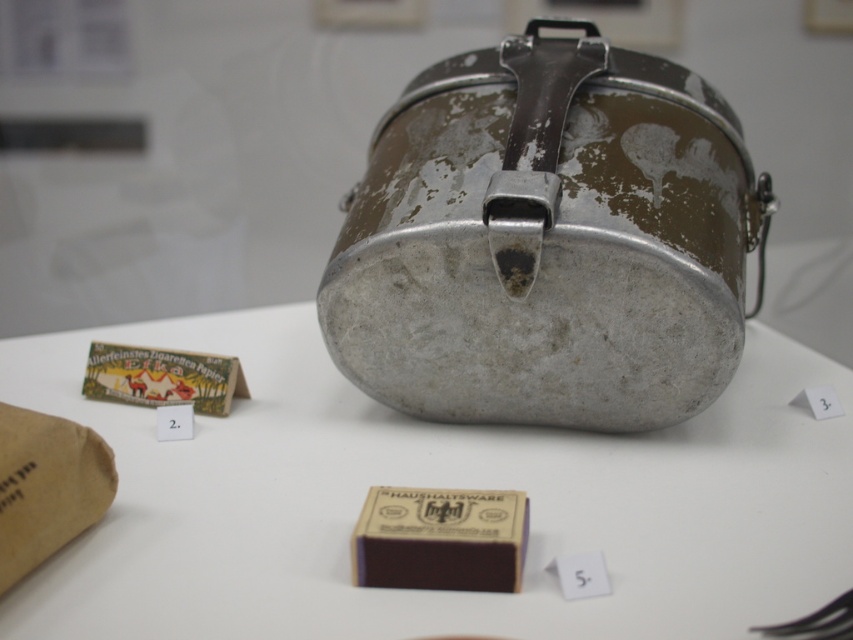
You are a delivery person who needs to place a 12 inch long package between the metallic silver container at center and the brown paper bag at lower left. Can you fit it there?

The distance between the metallic silver container at center and the brown paper bag at lower left is 12.30 inches. Since the package is 12 inches long, it can fit in the space between them as there is enough room.

You are an appraiser examining the items in the scene. You need to assess the distance between the metallic silver container at center and the dirty metallic lunchbox at center. Which one is nearer to you?

The metallic silver container at center is closer to the viewer than the dirty metallic lunchbox at center, so the metallic silver container at center is nearer.